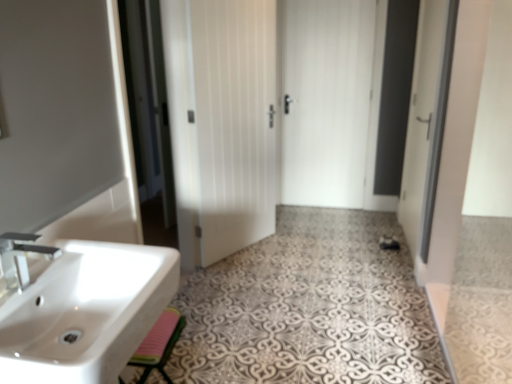
Question: Is white matte door at center, which is the second door from right to left, shorter than white matte door at center, the 2th door in the front-to-back sequence?

Choices:
 (A) yes
 (B) no

Answer: (A)

Question: Is white matte door at center, the 2th door from the back, in front of white matte door at center, the 2th door in the left-to-right sequence?

Choices:
 (A) yes
 (B) no

Answer: (A)

Question: Could you tell me if white matte door at center, positioned as the 1th door in left-to-right order, is turned towards white matte door at center, the 2th door in the left-to-right sequence?

Choices:
 (A) no
 (B) yes

Answer: (A)

Question: Does white matte door at center, the 2th door from the back, appear on the right side of white matte door at center, which is the 1th door from right to left?

Choices:
 (A) yes
 (B) no

Answer: (B)

Question: Considering the relative positions of white matte door at center, positioned as the 1th door in left-to-right order, and white matte door at center, the 2th door in the left-to-right sequence, in the image provided, is white matte door at center, positioned as the 1th door in left-to-right order, behind white matte door at center, the 2th door in the left-to-right sequence,?

Choices:
 (A) yes
 (B) no

Answer: (B)

Question: Could white matte door at center, the 2th door in the left-to-right sequence, be considered to be inside white matte door at center, the 2th door from the back?

Choices:
 (A) no
 (B) yes

Answer: (A)

Question: Can you confirm if pink rubber mat at lower left is smaller than white matte door at center, marked as the first door in a front-to-back arrangement?

Choices:
 (A) no
 (B) yes

Answer: (B)

Question: Can you confirm if pink rubber mat at lower left is bigger than white matte door at center, the 2th door from the back?

Choices:
 (A) yes
 (B) no

Answer: (B)

Question: Does pink rubber mat at lower left lie in front of white matte door at center, the 2th door from the back?

Choices:
 (A) no
 (B) yes

Answer: (B)

Question: Is pink rubber mat at lower left located outside white matte door at center, the 2th door from the back?

Choices:
 (A) yes
 (B) no

Answer: (A)

Question: Can you confirm if pink rubber mat at lower left is positioned to the left of white matte door at center, positioned as the 1th door in left-to-right order?

Choices:
 (A) no
 (B) yes

Answer: (B)

Question: From a real-world perspective, is pink rubber mat at lower left on white matte door at center, the 2th door from the back?

Choices:
 (A) yes
 (B) no

Answer: (B)

Question: Does white matte door at center, marked as the first door in a front-to-back arrangement, come in front of matte silver faucet at left?

Choices:
 (A) yes
 (B) no

Answer: (B)